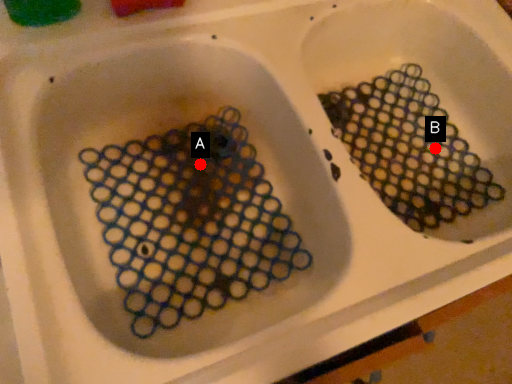
Question: Two points are circled on the image, labeled by A and B beside each circle. Which point is farther from the camera taking this photo?

Choices:
 (A) A is further
 (B) B is further

Answer: (B)